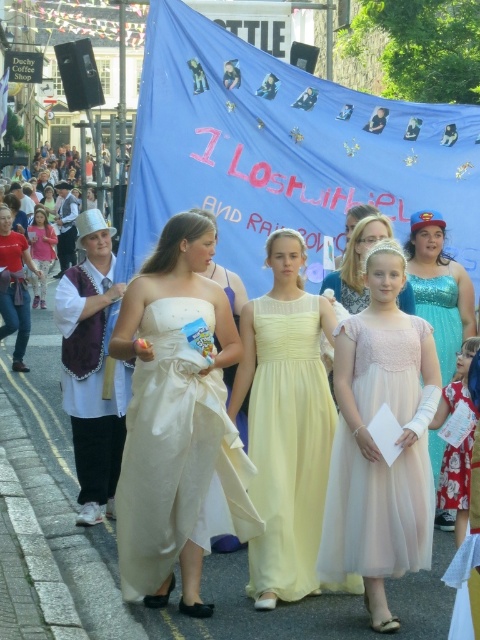
Question: Can you confirm if pale pink tulle dress at center is positioned to the right of light pink satin dress at center?

Choices:
 (A) no
 (B) yes

Answer: (A)

Question: Which is farther from the pale pink tulle dress at center?

Choices:
 (A) light pink satin dress at center
 (B) light yellow satin dress at center

Answer: (A)

Question: Is ivory satin dress at center bigger than light yellow satin dress at center?

Choices:
 (A) yes
 (B) no

Answer: (A)

Question: Which point is closer to the camera?

Choices:
 (A) light pink satin dress at center
 (B) light yellow satin dress at center
 (C) ivory satin dress at center

Answer: (C)

Question: Is pale pink tulle dress at center smaller than light pink satin dress at center?

Choices:
 (A) yes
 (B) no

Answer: (B)

Question: Among these objects, which one is nearest to the camera?

Choices:
 (A) ivory satin dress at center
 (B) pale pink tulle dress at center
 (C) light yellow satin dress at center

Answer: (B)